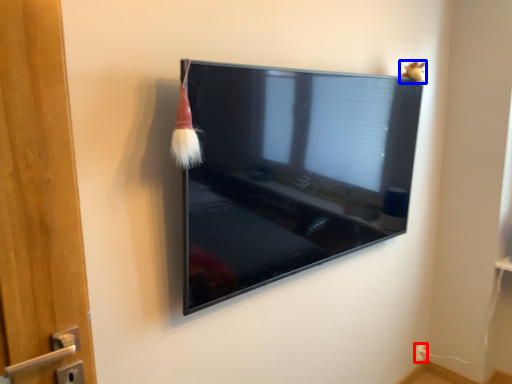
Question: Which object appears farthest to the camera in this image, electric outlet (highlighted by a red box) or animal (highlighted by a blue box)?

Choices:
 (A) electric outlet
 (B) animal

Answer: (A)